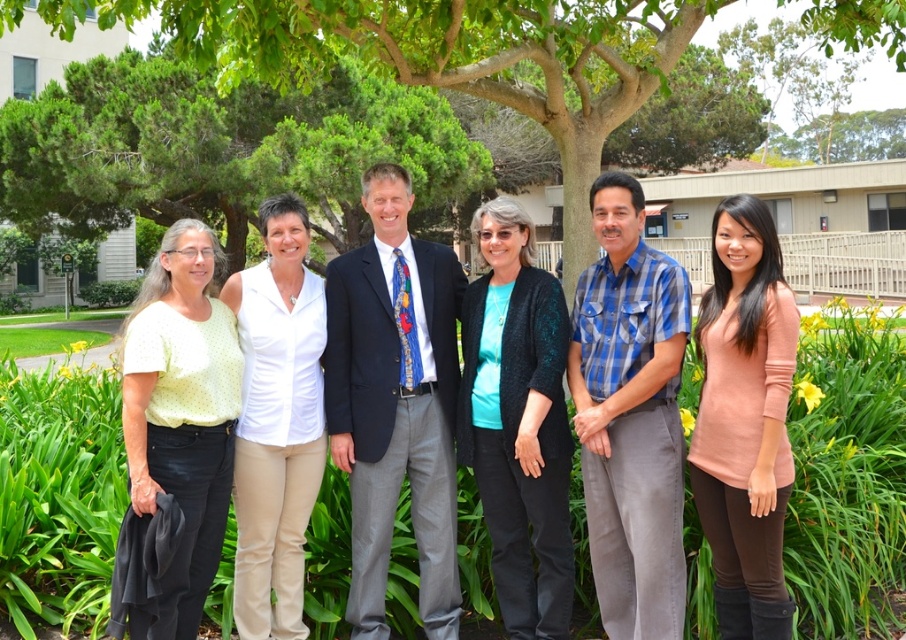
Question: Is green leafy tree at upper center in front of white smooth shirt at center?

Choices:
 (A) yes
 (B) no

Answer: (B)

Question: Which of the following is the closest to the observer?

Choices:
 (A) (120, 104)
 (B) (604, 269)
 (C) (844, 44)
 (D) (152, 301)

Answer: (D)

Question: Considering the real-world distances, which object is farthest from the dark blue suit at center?

Choices:
 (A) peach soft sweater at center
 (B) light yellow dotted blouse at left

Answer: (A)

Question: Observing the image, what is the correct spatial positioning of green leafy tree at center in reference to white smooth shirt at center?

Choices:
 (A) right
 (B) left

Answer: (A)

Question: Is green leafy tree at center behind teal matte shirt at center?

Choices:
 (A) no
 (B) yes

Answer: (A)

Question: Which point is farther to the camera?

Choices:
 (A) (294, 534)
 (B) (685, 332)
 (C) (527, 561)

Answer: (A)